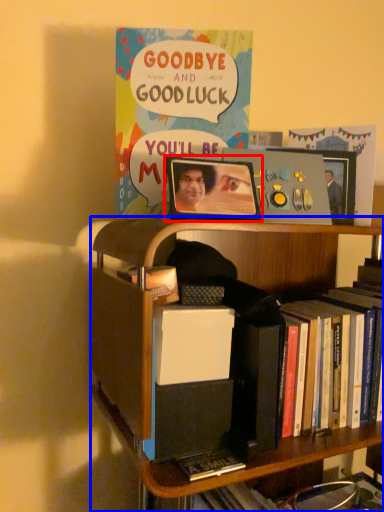
Question: Which of the following is the closest to the observer, picture frame (highlighted by a red box) or bookcase (highlighted by a blue box)?

Choices:
 (A) picture frame
 (B) bookcase

Answer: (B)